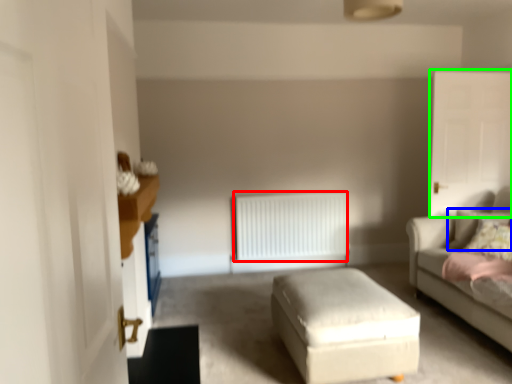
Question: Which object is positioned closest to radiator (highlighted by a red box)? Select from pillow (highlighted by a blue box) and glass door (highlighted by a green box).

Choices:
 (A) pillow
 (B) glass door

Answer: (B)